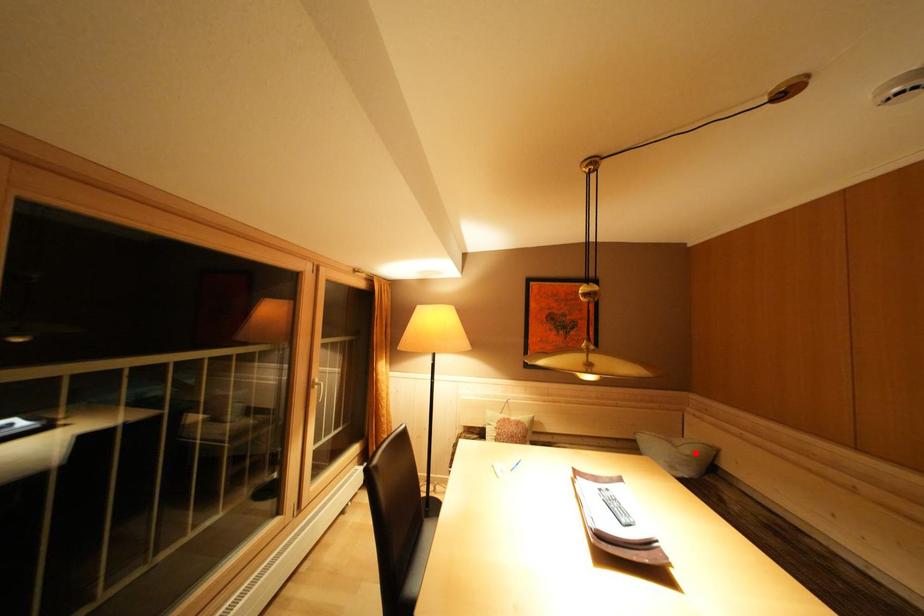
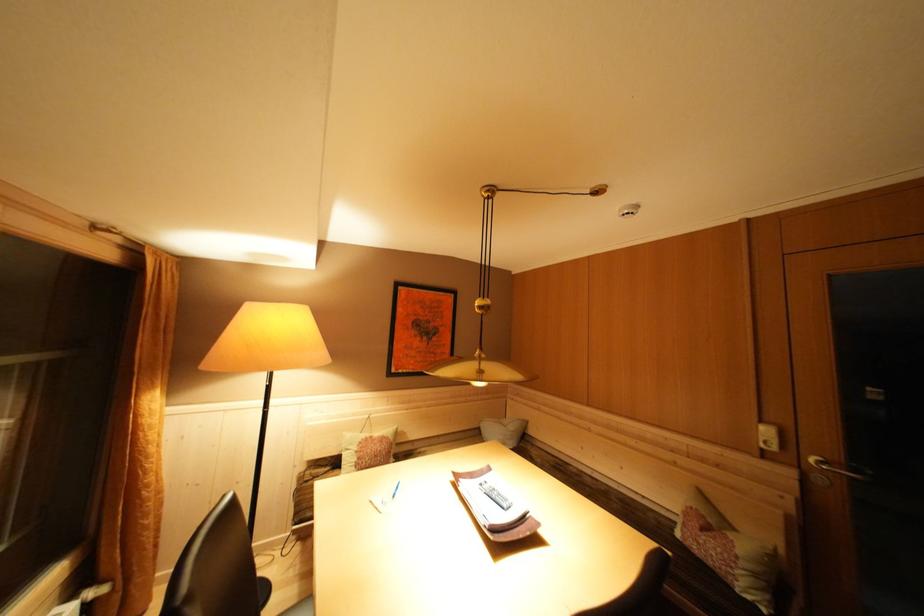
Question: A red point is marked in image1. In image2, is the corresponding 3D point closer to the camera or farther? Reply with the corresponding letter.

Choices:
 (A) The corresponding 3D point is closer.
 (B) The corresponding 3D point is farther.

Answer: (B)